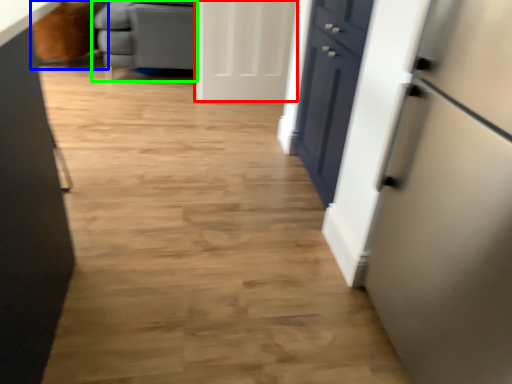
Question: Based on their relative distances, which object is farther from door (highlighted by a red box)? Choose from armchair (highlighted by a blue box) and furniture (highlighted by a green box).

Choices:
 (A) armchair
 (B) furniture

Answer: (A)